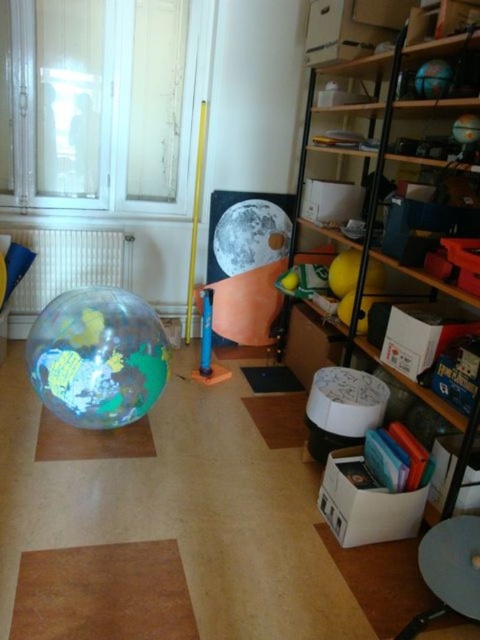
You are organizing a classroom and need to place the transparent plastic globe at center and the shiny metallic moon at center on a shelf. The shelf has a height limit of 1 meter. Can both items fit vertically without exceeding the height limit?

The transparent plastic globe at center is larger in size than the shiny metallic moon at center. However, since the exact height of the globe isn t provided, we cannot determine if it exceeds the 1 meter limit. Please check the actual dimensions of the globe to ensure compliance.

Please provide the 2D coordinates of the wooden shelves at right in the scene described.

The wooden shelves at right are located at the 2D coordinates of point (387,173).

You are standing in the room and want to place a new poster on the wooden shelves at right. Where exactly should you place it?

You should place the new poster on the wooden shelves at right at point [387,173].